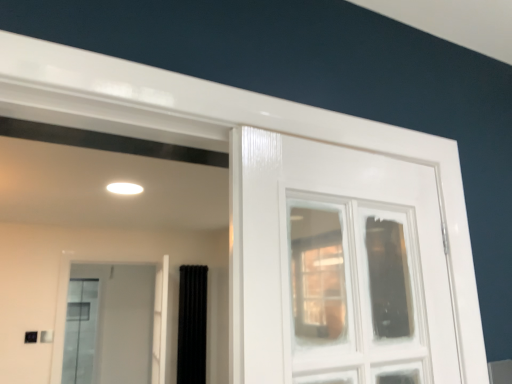
This screenshot has width=512, height=384. What do you see at coordinates (356, 292) in the screenshot?
I see `clear glass window at center` at bounding box center [356, 292].

Locate an element on the screen. This screenshot has width=512, height=384. clear glass screen door at upper left is located at coordinates (109, 324).

In order to click on black velvet curtain at center in this screenshot , I will do `click(192, 325)`.

Considering the points (206, 312) and (323, 257), which point is in front, point (206, 312) or point (323, 257)?

The point (323, 257) is in front.

Who is bigger, black velvet curtain at center or clear glass window at center?

With larger size is clear glass window at center.

From a real-world perspective, which object stands above the other?

clear glass window at center, from a real-world perspective.

Is black velvet curtain at center aimed at clear glass window at center?

Yes, black velvet curtain at center is aimed at clear glass window at center.

Would you say clear glass screen door at upper left is a long distance from black velvet curtain at center?

That's right, there is a large distance between clear glass screen door at upper left and black velvet curtain at center.

Between clear glass screen door at upper left and black velvet curtain at center, which one has more height?

clear glass screen door at upper left is taller.

Could you tell me if clear glass screen door at upper left is turned towards black velvet curtain at center?

No.

From a real-world perspective, which object rests below the other?

black velvet curtain at center.

From a real-world perspective, who is located lower, clear glass screen door at upper left or clear glass window at center?

clear glass screen door at upper left, from a real-world perspective.

Does point (98, 323) come behind point (368, 283)?

Yes, point (98, 323) is farther from viewer.

Consider the image. Who is smaller, clear glass screen door at upper left or clear glass window at center?

clear glass window at center.

Could you tell me if clear glass screen door at upper left is turned towards clear glass window at center?

Yes, clear glass screen door at upper left is facing clear glass window at center.

In terms of width, does clear glass window at center look wider or thinner when compared to clear glass screen door at upper left?

clear glass window at center is thinner than clear glass screen door at upper left.

Looking at this image, can you confirm if clear glass window at center is positioned to the right of clear glass screen door at upper left?

Yes.

Is point (389, 318) positioned after point (65, 373)?

No, it is not.

How different are the orientations of clear glass window at center and black velvet curtain at center in degrees?

90.2 degrees separate the facing orientations of clear glass window at center and black velvet curtain at center.

In the scene shown: From a real-world perspective, is clear glass window at center under black velvet curtain at center?

Incorrect, from a real-world perspective, clear glass window at center is higher than black velvet curtain at center.

Does clear glass window at center have a larger size compared to black velvet curtain at center?

Indeed, clear glass window at center has a larger size compared to black velvet curtain at center.

Which of these two, black velvet curtain at center or clear glass screen door at upper left, is thinner?

Thinner between the two is clear glass screen door at upper left.

From a real-world perspective, is black velvet curtain at center under clear glass screen door at upper left?

Yes.

Can you confirm if black velvet curtain at center is positioned to the right of clear glass screen door at upper left?

Correct, you'll find black velvet curtain at center to the right of clear glass screen door at upper left.

From the image's perspective, is black velvet curtain at center positioned above or below clear glass screen door at upper left?

From the image's perspective, black velvet curtain at center appears below clear glass screen door at upper left.

Locate an element on the screen. The height and width of the screenshot is (384, 512). window above the black velvet curtain at center (from a real-world perspective) is located at coordinates (356, 292).

Locate an element on the screen. This screenshot has width=512, height=384. curtain below the clear glass screen door at upper left (from a real-world perspective) is located at coordinates (192, 325).

Which object lies nearer to the anchor point clear glass window at center, black velvet curtain at center or clear glass screen door at upper left?

black velvet curtain at center lies closer to clear glass window at center than the other object.

Considering their positions, is clear glass window at center positioned closer to black velvet curtain at center than clear glass screen door at upper left?

The object closer to black velvet curtain at center is clear glass screen door at upper left.

When comparing their distances from clear glass screen door at upper left, does black velvet curtain at center or clear glass window at center seem further?

clear glass window at center is positioned further to the anchor clear glass screen door at upper left.

When comparing their distances from clear glass screen door at upper left, does clear glass window at center or black velvet curtain at center seem closer?

Among the two, black velvet curtain at center is located nearer to clear glass screen door at upper left.

Looking at this image, which object lies nearer to the anchor point clear glass window at center, clear glass screen door at upper left or black velvet curtain at center?

black velvet curtain at center.

Looking at the image, which one is located closer to black velvet curtain at center, clear glass screen door at upper left or clear glass window at center?

clear glass screen door at upper left lies closer to black velvet curtain at center than the other object.

The image size is (512, 384). What are the coordinates of `screen door positioned between clear glass window at center and black velvet curtain at center from near to far` in the screenshot? It's located at (109, 324).